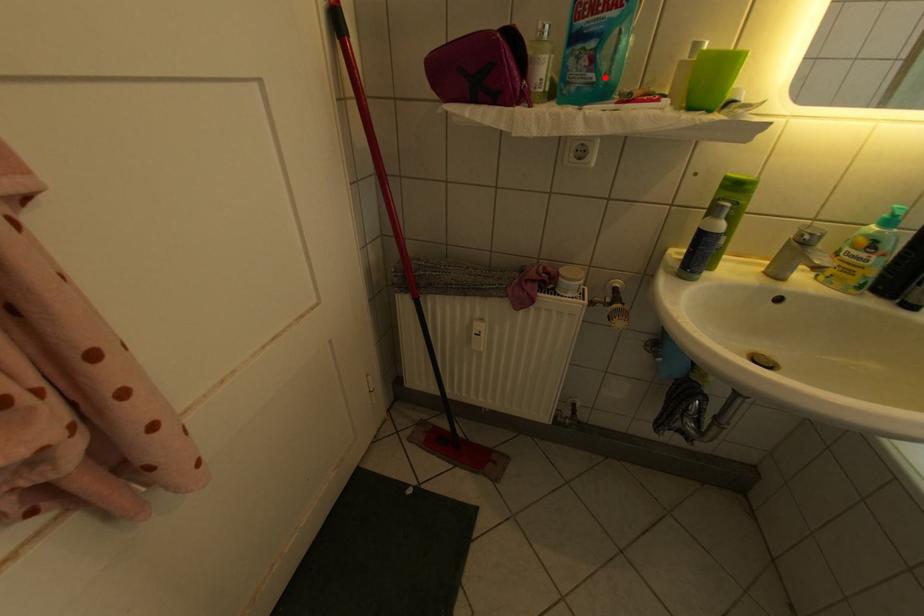
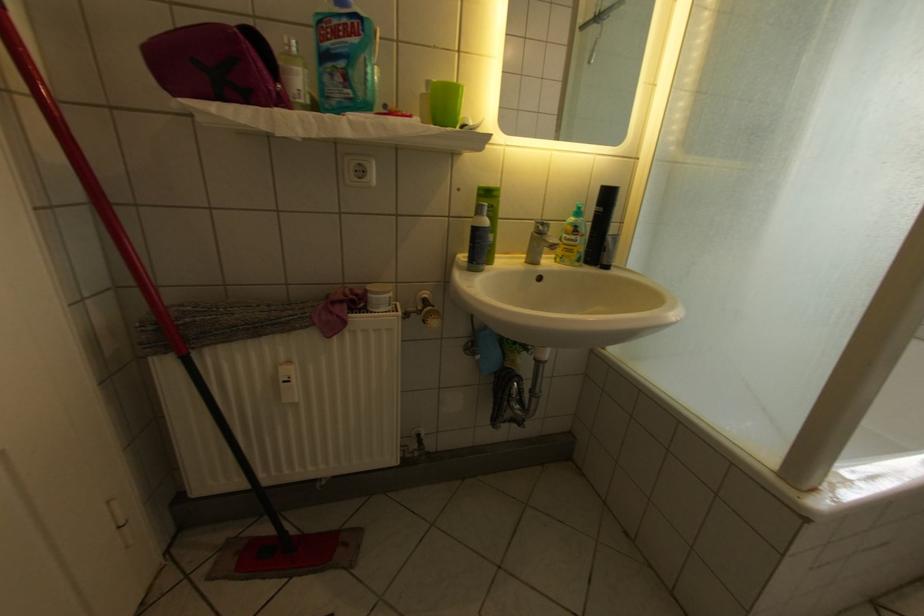
The point at the highlighted location is marked in the first image. Where is the corresponding point in the second image?

(360, 92)